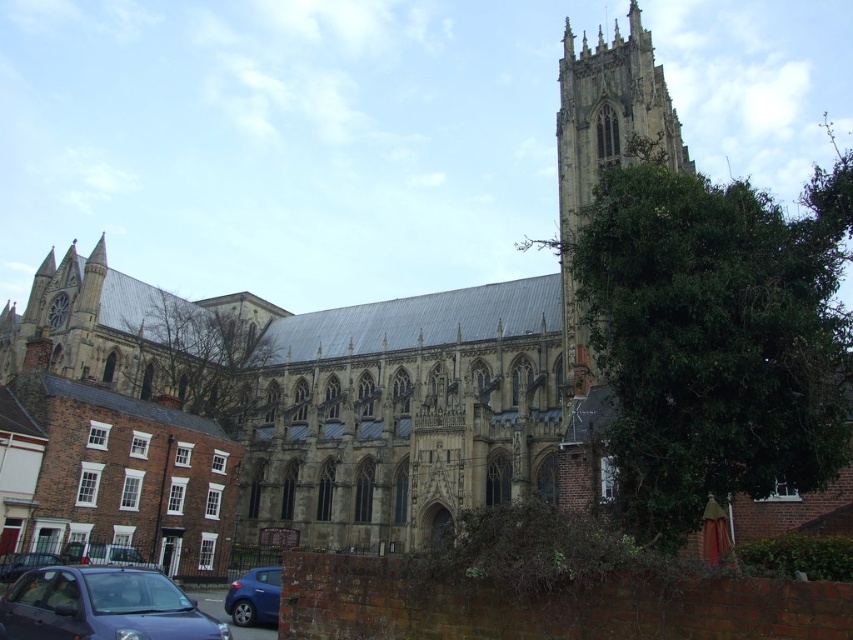
Is stone church at center thinner than matte blue car at lower left?

No, stone church at center is not thinner than matte blue car at lower left.

Between stone church at center and matte blue car at lower left, which one has less height?

With less height is matte blue car at lower left.

Describe the element at coordinates (405, 408) in the screenshot. The width and height of the screenshot is (853, 640). I see `stone church at center` at that location.

In order to click on stone church at center in this screenshot , I will do `click(405, 408)`.

Does point (341, 317) lie in front of point (0, 566)?

No, (341, 317) is behind (0, 566).

Who is positioned more to the left, stone church at center or metallic blue car at lower left?

Positioned to the left is metallic blue car at lower left.

Is point (633, 88) behind point (4, 579)?

That is True.

Where is `stone church at center`? This screenshot has height=640, width=853. stone church at center is located at coordinates (405, 408).

Looking at this image, between matte blue car at lower left and matte black car at lower left, which one is positioned higher?

matte blue car at lower left is higher up.

Does matte blue car at lower left have a greater height compared to matte black car at lower left?

Yes, matte blue car at lower left is taller than matte black car at lower left.

Which is behind, point (103, 593) or point (68, 556)?

Point (68, 556)

Find the location of a particular element. The image size is (853, 640). matte blue car at lower left is located at coordinates (102, 605).